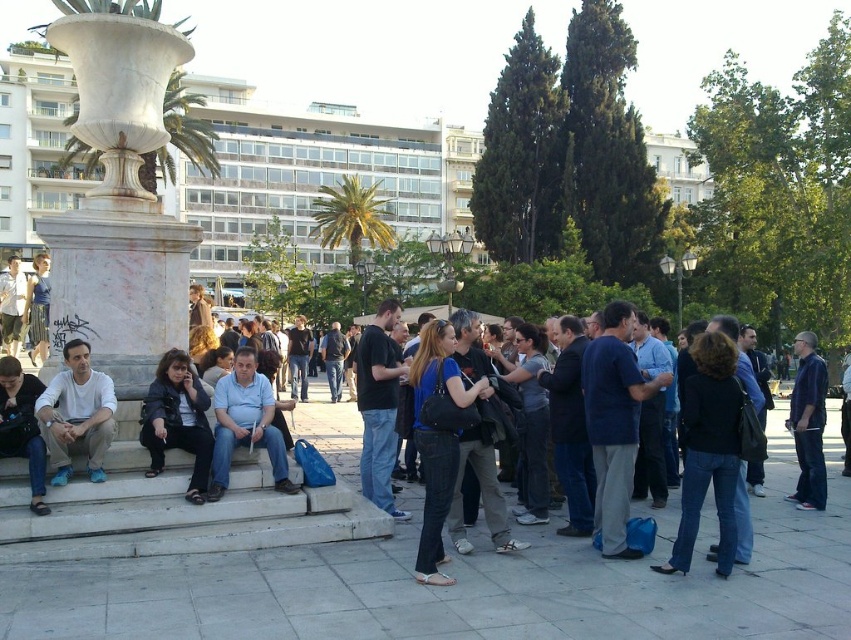
You are a photographer trying to capture both the dark blue jeans at center and the dark blue leather jacket at lower left in a single frame. Given that your camera has a 50mm lens, which has a field of view of approximately 46 degrees, can you position yourself such that both objects are within the frame without moving either object?

The distance between the dark blue jeans at center and the dark blue leather jacket at lower left is 9.46 meters. To determine if they can fit in a 50mm lens field of view of 46 degrees, we need to calculate the required distance from the photographer to the subjects. However, without knowing the distance from the photographer to the subjects, we cannot definitively answer this. The angle of view depends on both the distance between the subjects and the photographer. If the photographer is positioned far, 9

You are a photographer standing in the plaza and want to take a photo of the dark blue jeans at center and the dark blue leather jacket at lower left. Which object is positioned lower in the image?

The dark blue jeans at center is located below the dark blue leather jacket at lower left, so it is positioned lower in the image.

You are a photographer trying to capture a candid shot of the dark blue jeans at center and the matte white shirt at left. Since you want to include both subjects in the frame, which subject should you position closer to the camera to ensure both fit in the shot?

The dark blue jeans at center is wider than the matte white shirt at left. To include both in the frame, position the matte white shirt at left closer to the camera since it is narrower, allowing more space for the wider dark blue jeans at center in the background.